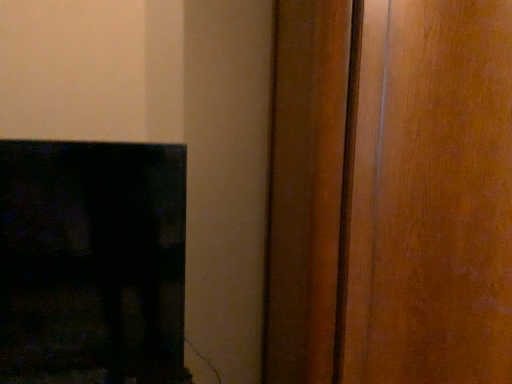
Question: Should I look upward or downward to see black glossy fireplace at lower left?

Choices:
 (A) up
 (B) down

Answer: (B)